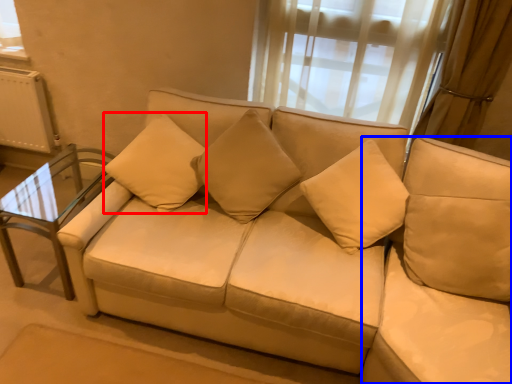
Question: Which object appears farthest to the camera in this image, pillow (highlighted by a red box) or beige (highlighted by a blue box)?

Choices:
 (A) pillow
 (B) beige

Answer: (A)